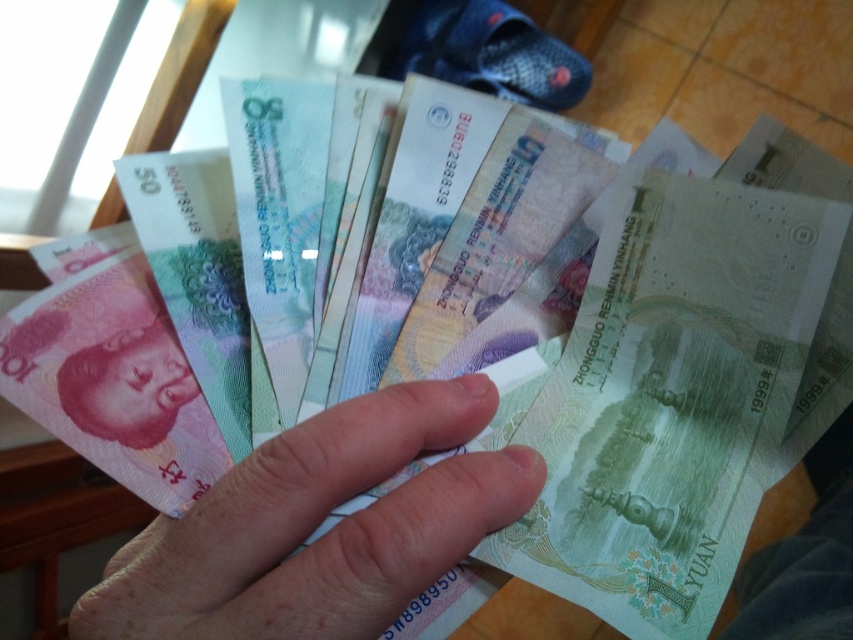
Based on the scene description, where is the smooth skin hand at center positioned in relation to the wooden surface?

The smooth skin hand at center is positioned above the wooden surface, as it is holding the banknotes which are resting on the surface.

You are a cashier at a store and need to reach for a customer who is standing 25 centimeters away from you. You see the smooth skin hand at center holding money. Can you reach the customer with your hand?

The smooth skin hand at center is 23.59 centimeters away from the viewer, so yes, the cashier can reach the customer who is 25 centimeters away since the hand is slightly closer than the required distance.

You are a security camera analyzing the scene. You need to determine if the smooth skin hand at center is in front of the matte paper money at lower left. Based on the spatial relationship, what is your conclusion?

The smooth skin hand at center is closer to the viewer than the matte paper money at lower left, so the smooth skin hand at center is in front of the matte paper money at lower left.